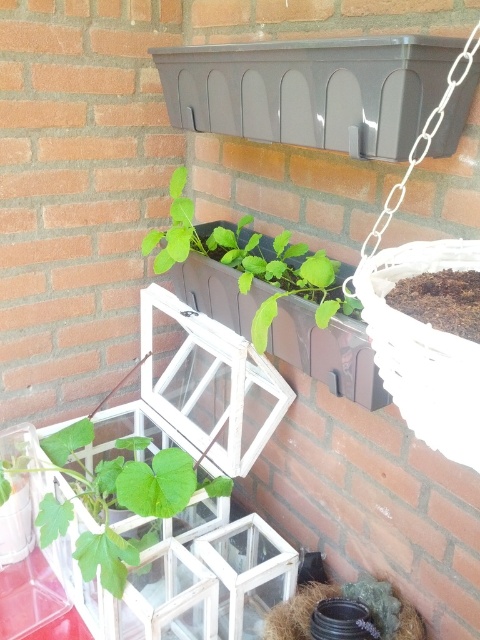
Between point (177, 460) and point (227, 230), which one is positioned in front?

Positioned in front is point (177, 460).

Is green matte leafy plant at center thinner than green matte plant at center?

No.

Is point (122, 493) farther from camera compared to point (350, 305)?

That is True.

You are a GUI agent. You are given a task and a screenshot of the screen. Output one action in this format:
    pyautogui.click(x=<x>, y=<y>)
    Task: Click on the green matte leafy plant at center
    The image size is (480, 640).
    Given the screenshot: What is the action you would take?
    pyautogui.click(x=124, y=497)